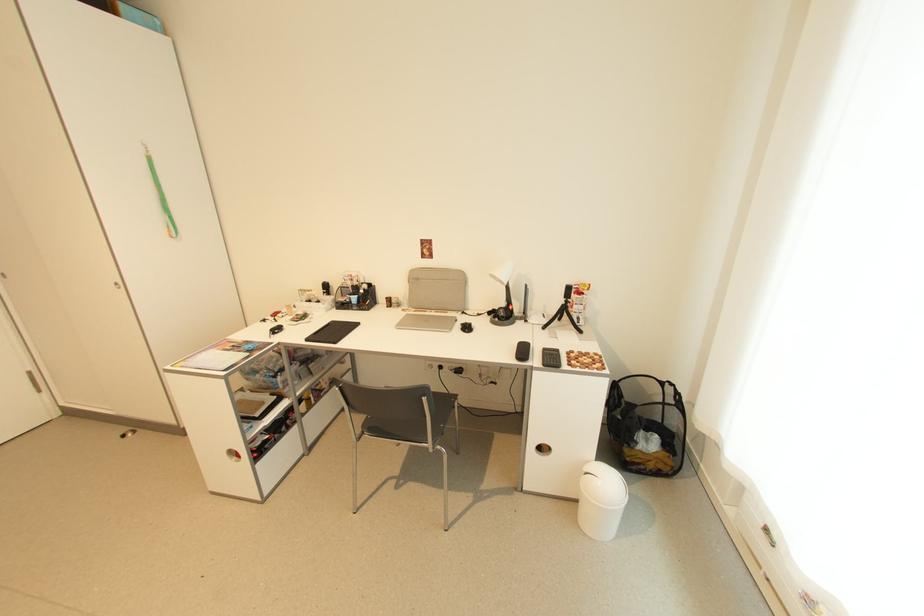
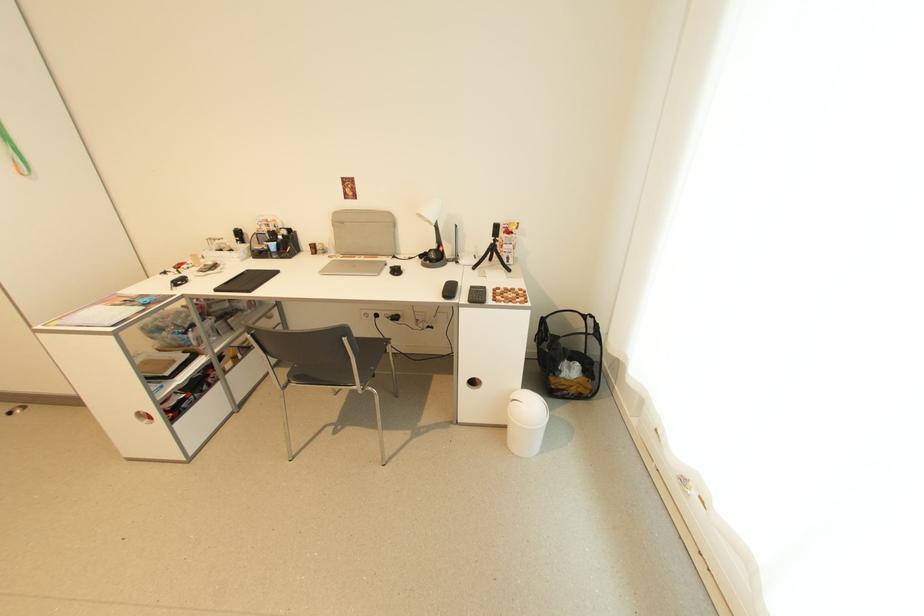
Locate, in the second image, the point that corresponds to the point at 507,306 in the first image.

(439, 248)